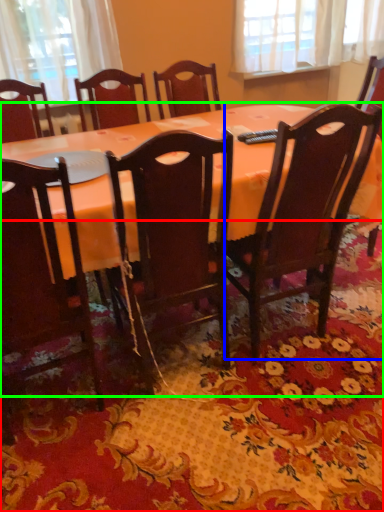
Question: Which object is positioned closest to mat (highlighted by a red box)? Select from chair (highlighted by a blue box) and table (highlighted by a green box).

Choices:
 (A) chair
 (B) table

Answer: (A)